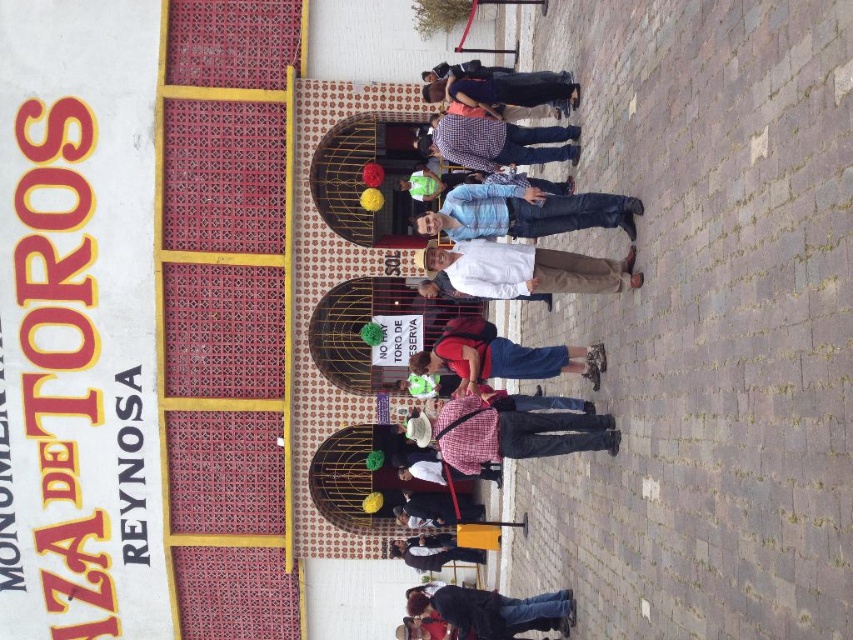
Can you confirm if plaid shirt at center is positioned to the left of checkered fabric shirt at center?

Yes, plaid shirt at center is to the left of checkered fabric shirt at center.

Is plaid shirt at center bigger than checkered fabric shirt at center?

No, plaid shirt at center is not bigger than checkered fabric shirt at center.

This screenshot has width=853, height=640. Describe the element at coordinates (514, 433) in the screenshot. I see `plaid shirt at center` at that location.

The image size is (853, 640). Find the location of `plaid shirt at center`. plaid shirt at center is located at coordinates (514, 433).

Measure the distance between blue striped shirt at center and camera.

The distance of blue striped shirt at center from camera is 31.74 meters.

Locate an element on the screen. blue striped shirt at center is located at coordinates (524, 212).

Which is above, blue striped shirt at center or white matte shirt at center?

Positioned higher is blue striped shirt at center.

Can you confirm if blue striped shirt at center is shorter than white matte shirt at center?

Incorrect, blue striped shirt at center's height does not fall short of white matte shirt at center's.

Does point (634, 212) come in front of point (564, 276)?

Yes, point (634, 212) is closer to viewer.

Identify the location of blue striped shirt at center. (524, 212).